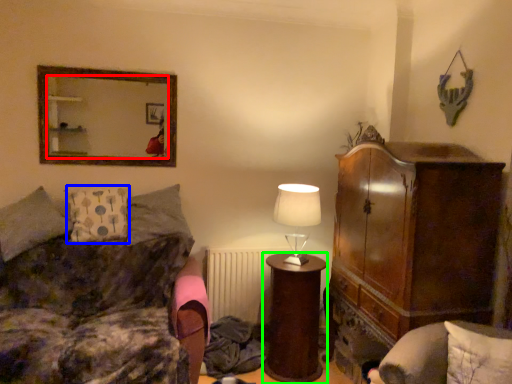
Question: Based on their relative distances, which object is farther from mirror (highlighted by a red box)? Choose from pillow (highlighted by a blue box) and desk (highlighted by a green box).

Choices:
 (A) pillow
 (B) desk

Answer: (B)